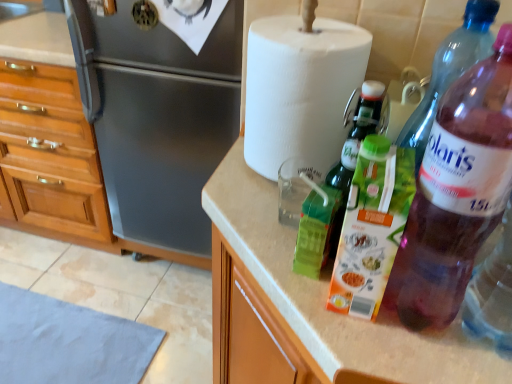
Question: Is brushed metal refrigerator at left turned away from white paper towel at upper center?

Choices:
 (A) no
 (B) yes

Answer: (A)

Question: Considering the relative positions of brushed metal refrigerator at left and white paper towel at upper center in the image provided, is brushed metal refrigerator at left to the left of white paper towel at upper center from the viewer's perspective?

Choices:
 (A) yes
 (B) no

Answer: (A)

Question: From the image's perspective, does brushed metal refrigerator at left appear lower than white paper towel at upper center?

Choices:
 (A) no
 (B) yes

Answer: (A)

Question: Could you tell me if brushed metal refrigerator at left is turned towards white paper towel at upper center?

Choices:
 (A) no
 (B) yes

Answer: (A)

Question: Considering the relative sizes of brushed metal refrigerator at left and white paper towel at upper center in the image provided, is brushed metal refrigerator at left thinner than white paper towel at upper center?

Choices:
 (A) no
 (B) yes

Answer: (A)

Question: Can you see brushed metal refrigerator at left touching white paper towel at upper center?

Choices:
 (A) yes
 (B) no

Answer: (B)

Question: From the image's perspective, does beige laminate countertop at center appear higher than white paper towel at upper center?

Choices:
 (A) no
 (B) yes

Answer: (A)

Question: Is beige laminate countertop at center outside of white paper towel at upper center?

Choices:
 (A) yes
 (B) no

Answer: (A)

Question: Does beige laminate countertop at center have a smaller size compared to white paper towel at upper center?

Choices:
 (A) no
 (B) yes

Answer: (A)

Question: Is beige laminate countertop at center in front of white paper towel at upper center?

Choices:
 (A) yes
 (B) no

Answer: (A)

Question: Can you confirm if beige laminate countertop at center is taller than white paper towel at upper center?

Choices:
 (A) yes
 (B) no

Answer: (B)

Question: Is beige laminate countertop at center in contact with white paper towel at upper center?

Choices:
 (A) no
 (B) yes

Answer: (A)

Question: Is green matte carton at center, which appears as the second bottle when viewed from the front, taller than purple translucent bottle at right, which is counted as the first bottle, starting from the back?

Choices:
 (A) no
 (B) yes

Answer: (B)